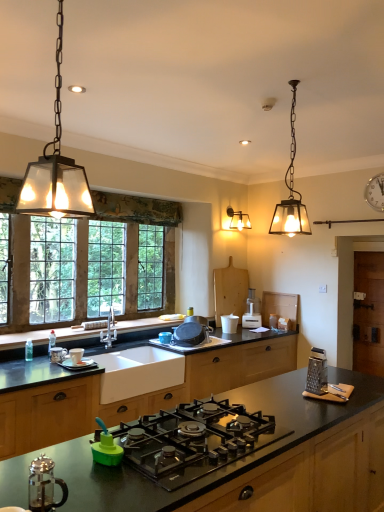
Question: Is metallic grater at right, which is counted as the second appliance, starting from the front, further to camera compared to green plastic bottle at lower center, which is the fifth appliance in right-to-left order?

Choices:
 (A) no
 (B) yes

Answer: (B)

Question: Is metallic grater at right, the first appliance positioned from the right, not near green plastic bottle at lower center, which is the 2th appliance in left-to-right order?

Choices:
 (A) no
 (B) yes

Answer: (B)

Question: Is metallic grater at right, the first appliance positioned from the right, facing towards green plastic bottle at lower center, which is the fifth appliance in right-to-left order?

Choices:
 (A) no
 (B) yes

Answer: (A)

Question: Considering the relative sizes of metallic grater at right, which is the 5th appliance in back-to-front order, and green plastic bottle at lower center, which is counted as the 6th appliance, starting from the back, in the image provided, is metallic grater at right, which is the 5th appliance in back-to-front order, bigger than green plastic bottle at lower center, which is counted as the 6th appliance, starting from the back,?

Choices:
 (A) yes
 (B) no

Answer: (B)

Question: Is metallic grater at right, which is counted as the second appliance, starting from the front, to the right of green plastic bottle at lower center, which is the 2th appliance in left-to-right order, from the viewer's perspective?

Choices:
 (A) yes
 (B) no

Answer: (A)

Question: Would you say white ceramic cup at lower left, positioned as the sixth appliance in right-to-left order, is to the left or to the right of matte glass sconce at upper right in the picture?

Choices:
 (A) right
 (B) left

Answer: (B)

Question: From the image's perspective, is white ceramic cup at lower left, positioned as the sixth appliance in right-to-left order, located above or below matte glass sconce at upper right?

Choices:
 (A) below
 (B) above

Answer: (A)

Question: From their relative heights in the image, would you say white ceramic cup at lower left, which is counted as the fourth appliance, starting from the back, is taller or shorter than matte glass sconce at upper right?

Choices:
 (A) tall
 (B) short

Answer: (B)

Question: Considering the positions of white ceramic cup at lower left, which is counted as the 3th appliance, starting from the front, and matte glass sconce at upper right in the image, is white ceramic cup at lower left, which is counted as the 3th appliance, starting from the front, wider or thinner than matte glass sconce at upper right?

Choices:
 (A) thin
 (B) wide

Answer: (A)

Question: Is white plastic cup at center, the 4th appliance in the left-to-right sequence, situated inside white ceramic cup at lower left, the 1th appliance from the left, or outside?

Choices:
 (A) inside
 (B) outside

Answer: (B)

Question: From the image's perspective, is white plastic cup at center, placed as the 3th appliance when sorted from right to left, located above or below white ceramic cup at lower left, the 1th appliance from the left?

Choices:
 (A) above
 (B) below

Answer: (A)

Question: From a real-world perspective, is white plastic cup at center, the 4th appliance in the left-to-right sequence, physically located above or below white ceramic cup at lower left, positioned as the sixth appliance in right-to-left order?

Choices:
 (A) above
 (B) below

Answer: (A)

Question: Considering the positions of white plastic cup at center, placed as the 3th appliance when sorted from right to left, and white ceramic cup at lower left, positioned as the sixth appliance in right-to-left order, in the image, is white plastic cup at center, placed as the 3th appliance when sorted from right to left, taller or shorter than white ceramic cup at lower left, positioned as the sixth appliance in right-to-left order,?

Choices:
 (A) short
 (B) tall

Answer: (B)

Question: From the image's perspective, is metallic grater at right, which is counted as the second appliance, starting from the front, located above or below white ceramic cup at lower left, positioned as the sixth appliance in right-to-left order?

Choices:
 (A) above
 (B) below

Answer: (A)

Question: Considering the relative positions of metallic grater at right, the sixth appliance from the left, and white ceramic cup at lower left, which is counted as the fourth appliance, starting from the back, in the image provided, is metallic grater at right, the sixth appliance from the left, to the left or to the right of white ceramic cup at lower left, which is counted as the fourth appliance, starting from the back,?

Choices:
 (A) left
 (B) right

Answer: (B)